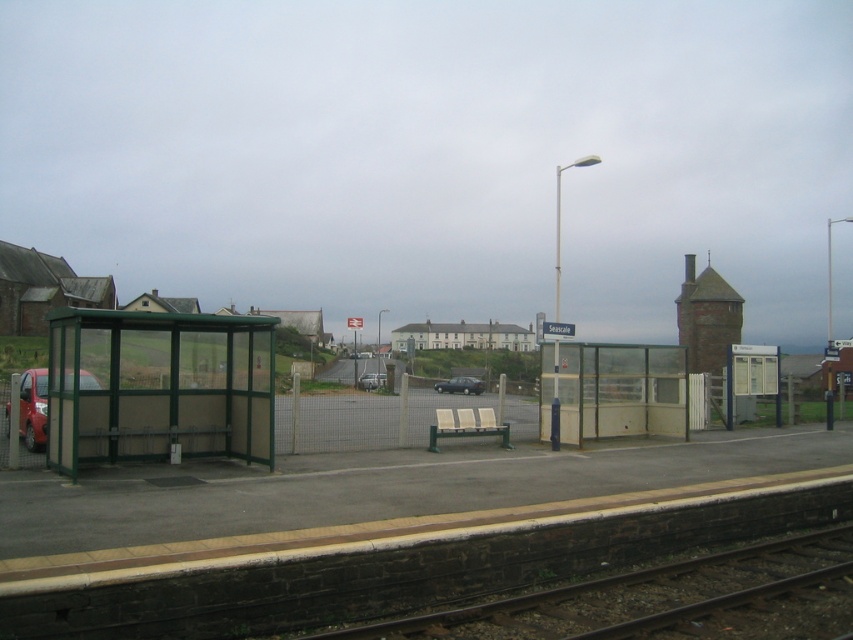
You are standing at the point marked by point (33, 408) on the image. What object is located at this point?

The point (33, 408) marks the location of the matte red car at left.

You are a delivery person needing to park your delivery van, which is 2 meters wide. You see the green metallic bus stop at left and the matte red car at left. Can you park your van between them?

The green metallic bus stop at left is smaller than the matte red car at left. Therefore, the space between them may be sufficient for your 2 meter wide van, but you should check the exact distance to ensure it fits.

You are a pedestrian standing on the platform and want to cross to the paved area. The two cars, matte red car at left and matte black car at center, are parked between you and the paved area. Which car should you move around to reach the paved area?

You should move around the matte black car at center because it is positioned to the right of the matte red car at left, so going around the matte black car at center would allow you to access the paved area.